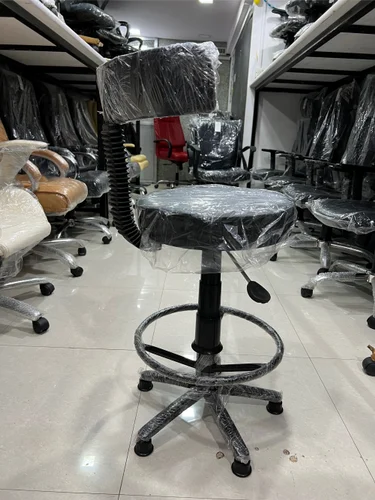
Where is `chair`? This screenshot has width=375, height=500. chair is located at coordinates (202, 179), (41, 176), (29, 236), (84, 163), (79, 141), (351, 223), (335, 107), (297, 148), (218, 211).